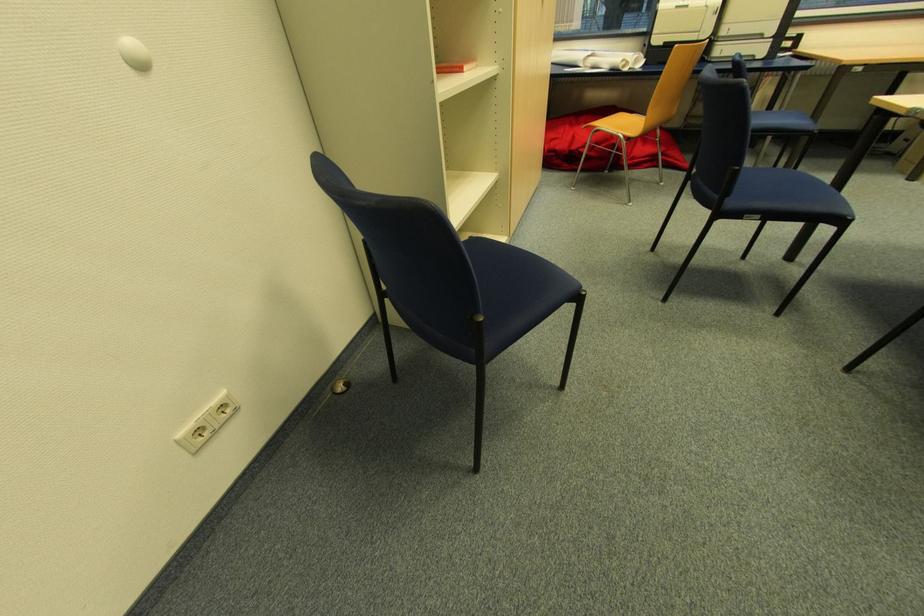
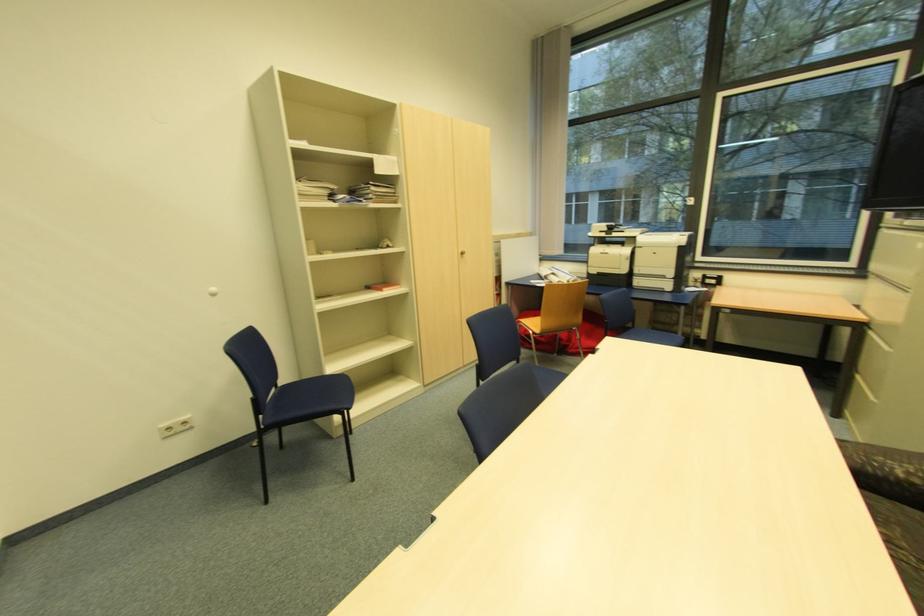
In the second image, find the point that corresponds to point 624,137 in the first image.

(532, 331)